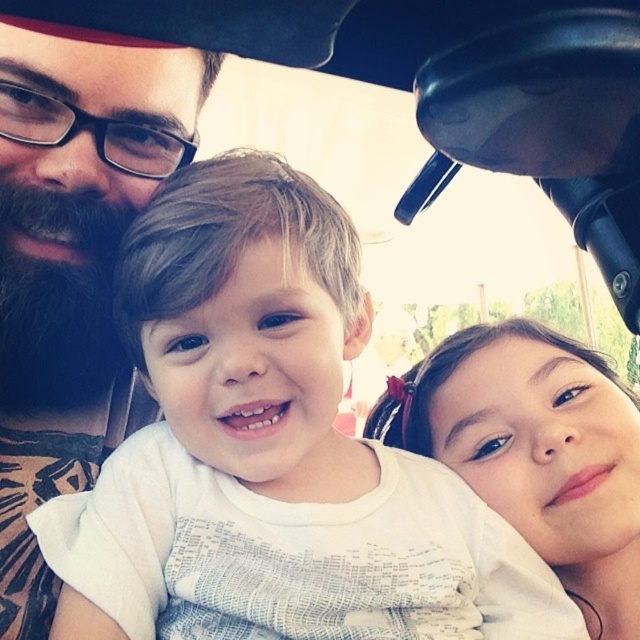
Question: In this image, where is white cotton shirt at center located relative to smooth skin face at right?

Choices:
 (A) right
 (B) left

Answer: (B)

Question: Among these objects, which one is nearest to the camera?

Choices:
 (A) smooth skin face at right
 (B) white cotton shirt at center
 (C) bearded man at left

Answer: (C)

Question: Observing the image, what is the correct spatial positioning of white cotton shirt at center in reference to bearded man at left?

Choices:
 (A) above
 (B) below

Answer: (B)

Question: Which of the following is the farthest from the observer?

Choices:
 (A) white cotton shirt at center
 (B) bearded man at left

Answer: (A)

Question: Is bearded man at left in front of smooth skin face at right?

Choices:
 (A) no
 (B) yes

Answer: (B)

Question: Estimate the real-world distances between objects in this image. Which object is closer to the bearded man at left?

Choices:
 (A) smooth skin face at right
 (B) white cotton shirt at center

Answer: (B)